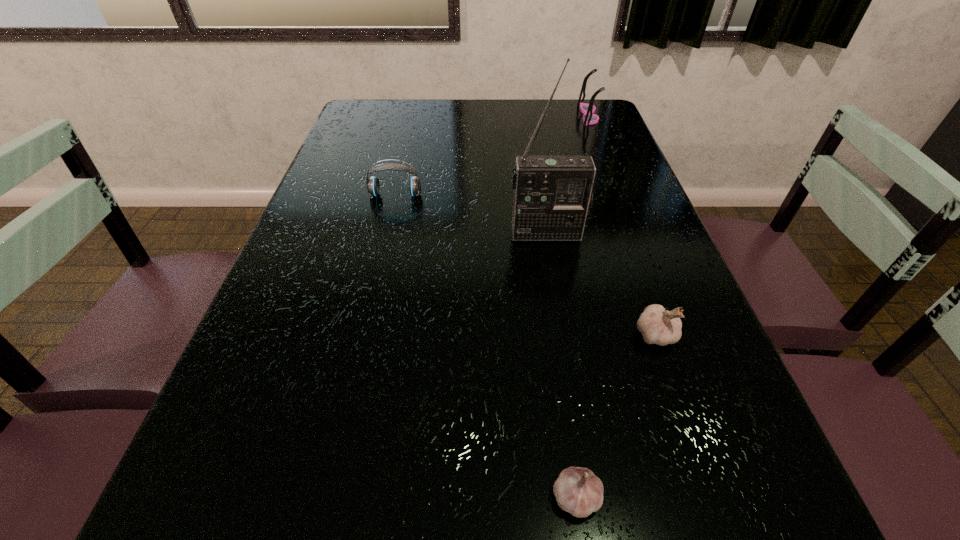
Locate an element on the screen. empty location between the taller garlic and the farthest object is located at coordinates (622, 225).

Locate an element on the screen. The height and width of the screenshot is (540, 960). free space that is in between the farther garlic and the second farthest object is located at coordinates (525, 265).

You are a GUI agent. You are given a task and a screenshot of the screen. Output one action in this format:
    pyautogui.click(x=<x>, y=<y>)
    Task: Click on the free space between the shortest object and the tallest object
    The height and width of the screenshot is (540, 960).
    Given the screenshot: What is the action you would take?
    pyautogui.click(x=562, y=366)

At what (x,y) coordinates should I click in order to perform the action: click on vacant point located between the farthest object and the taller garlic. Please return your answer as a coordinate pair (x, y). Looking at the image, I should click on 622,225.

This screenshot has width=960, height=540. I want to click on vacant region between the leftmost object and the fourth shortest object, so click(492, 155).

The image size is (960, 540). Identify the location of empty space between the radio receiver and the fourth farthest object. (601, 284).

Where is `object that is the second closest to the leftmost object`? The width and height of the screenshot is (960, 540). object that is the second closest to the leftmost object is located at coordinates (657, 326).

At what (x,y) coordinates should I click in order to perform the action: click on object that stands as the second closest to the nearest object. Please return your answer as a coordinate pair (x, y). Image resolution: width=960 pixels, height=540 pixels. Looking at the image, I should click on tap(552, 194).

Identify the location of vacant space that satisfies the following two spatial constraints: 1. on the back side of the taller garlic; 2. on the right side of the nearer garlic. (553, 334).

Find the location of `free space that satisfies the following two spatial constraints: 1. on the ear cups of the shorter garlic; 2. on the left side of the headset`. free space that satisfies the following two spatial constraints: 1. on the ear cups of the shorter garlic; 2. on the left side of the headset is located at coordinates (324, 498).